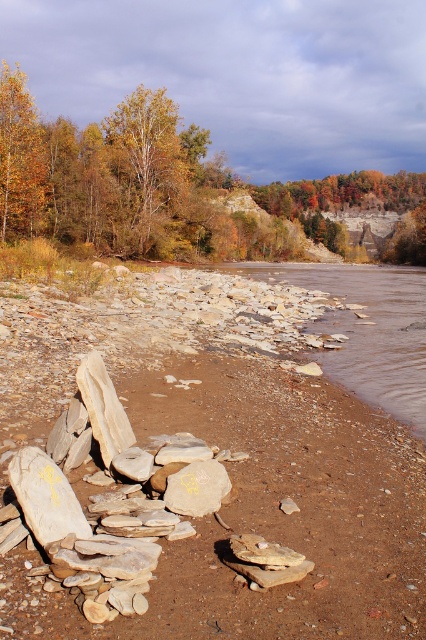
You are standing at the riverside and want to pick up the smooth stone rocks at center. Which direction should you move to reach them from the golden yellow leaves at upper left?

The smooth stone rocks at center are located below the golden yellow leaves at upper left, so you should move downward from the golden yellow leaves at upper left to reach them.